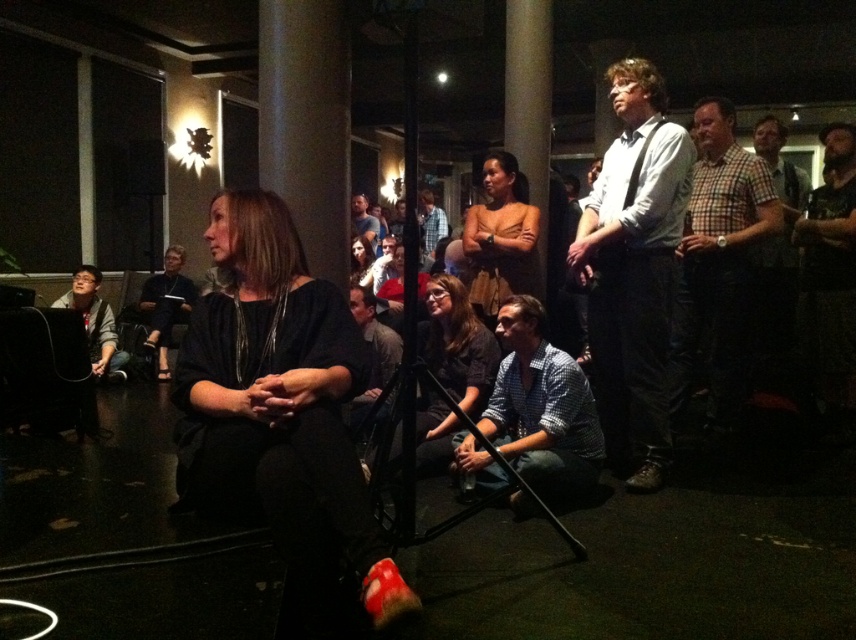
In the scene, there are two men in the background wearing a white shirt with black suspenders at center and a blue plaid shirt at center. Which one appears taller?

The white shirt with black suspenders at center is much taller than the blue plaid shirt at center.

You are standing in the conference room and see two points marked in the image. Which point is nearer to you, point [382,412] or point [424,260]?

Point [382,412] is closer to the viewer than point [424,260].

You are a stagehand who needs to move a 13 feet long ladder from the back of the room to the front. There is a white shirt with black suspenders at center and a blue plaid shirt at center in the way. Can you maneuver the ladder through the space between them without touching them?

The distance between the white shirt with black suspenders at center and the blue plaid shirt at center is 12.95 feet. Since the ladder is 13 feet long, it is slightly longer than the available space. Therefore, you cannot maneuver the ladder through the space between them without touching the individuals.